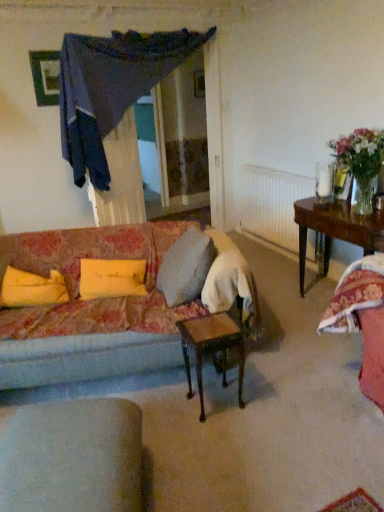
Question: Can you confirm if translucent glass vase at upper right is shorter than white textured radiator at center?

Choices:
 (A) yes
 (B) no

Answer: (A)

Question: Would you say white textured radiator at center is part of translucent glass vase at upper right's contents?

Choices:
 (A) yes
 (B) no

Answer: (B)

Question: From a real-world perspective, is translucent glass vase at upper right under white textured radiator at center?

Choices:
 (A) no
 (B) yes

Answer: (A)

Question: Is translucent glass vase at upper right at the right side of white textured radiator at center?

Choices:
 (A) yes
 (B) no

Answer: (A)

Question: Is translucent glass vase at upper right next to white textured radiator at center?

Choices:
 (A) no
 (B) yes

Answer: (A)

Question: Is white textured radiator at center situated inside clear glass vase at right or outside?

Choices:
 (A) outside
 (B) inside

Answer: (A)

Question: Looking at their shapes, would you say white textured radiator at center is wider or thinner than clear glass vase at right?

Choices:
 (A) thin
 (B) wide

Answer: (B)

Question: Does point (264, 218) appear closer or farther from the camera than point (365, 186)?

Choices:
 (A) closer
 (B) farther

Answer: (B)

Question: Considering the positions of white textured radiator at center and clear glass vase at right in the image, is white textured radiator at center taller or shorter than clear glass vase at right?

Choices:
 (A) tall
 (B) short

Answer: (A)

Question: Is point (337, 203) closer or farther from the camera than point (372, 178)?

Choices:
 (A) closer
 (B) farther

Answer: (B)

Question: From the image's perspective, is brown wooden table at right, the first table from the right, located above or below translucent glass vase at upper right?

Choices:
 (A) below
 (B) above

Answer: (A)

Question: Is brown wooden table at right, the second table from the front, in front of or behind translucent glass vase at upper right in the image?

Choices:
 (A) behind
 (B) front

Answer: (A)

Question: Looking at their shapes, would you say brown wooden table at right, placed as the 2th table when sorted from left to right, is wider or thinner than translucent glass vase at upper right?

Choices:
 (A) thin
 (B) wide

Answer: (B)

Question: Is light gray fabric chair at lower left taller or shorter than brown wooden table at right, placed as the 2th table when sorted from left to right?

Choices:
 (A) tall
 (B) short

Answer: (B)

Question: Is point (67, 502) closer or farther from the camera than point (301, 287)?

Choices:
 (A) farther
 (B) closer

Answer: (B)